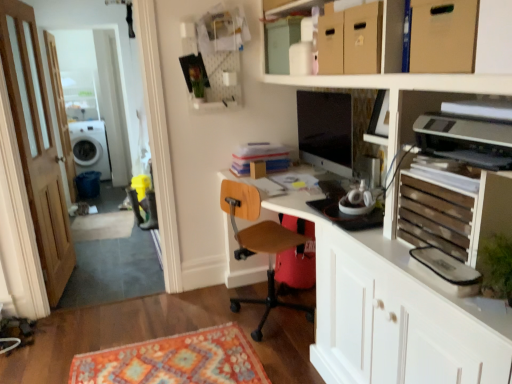
This screenshot has width=512, height=384. I want to click on vacant space to the right of wooden door at left, so click(127, 276).